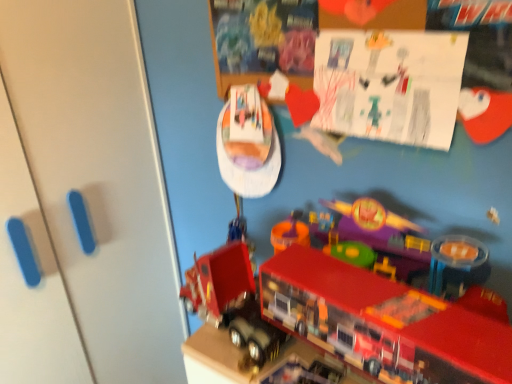
This screenshot has height=384, width=512. In order to click on blank space above shiny plastic fire truck at lower right, the 2th toy in the bottom-to-top sequence (from a real-world perspective) in this screenshot , I will do `click(353, 290)`.